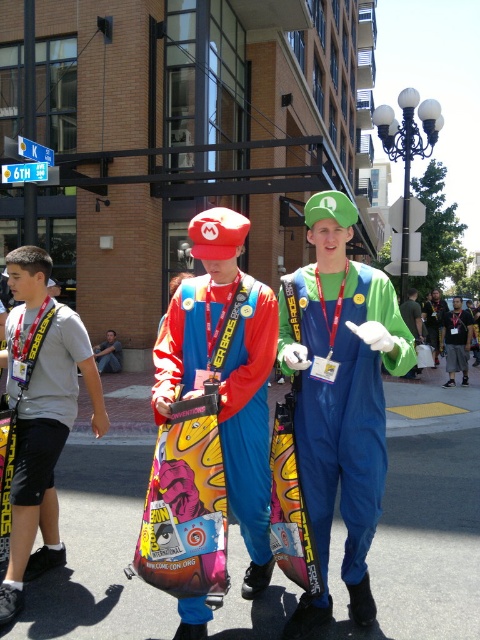
You are standing at the point closest to the Mario costume. There are two points marked in the image, one at coordinates point (299,465) and the other at point (260,499). Which point is closer to you?

Point (299,465) is in front of point (260,499), so the point closer to you is point (299,465).

You are at a convention and see the green matte luigi costume at center and the matte plastic bag at center. Which object is positioned more to the left?

The matte plastic bag at center is positioned more to the left because the green matte luigi costume at center is to the right of it.